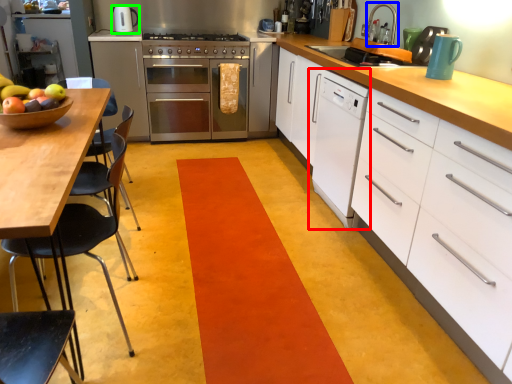
Question: Which is farther away from home appliance (highlighted by a red box)? appliance (highlighted by a blue box) or kitchen appliance (highlighted by a green box)?

Choices:
 (A) appliance
 (B) kitchen appliance

Answer: (B)